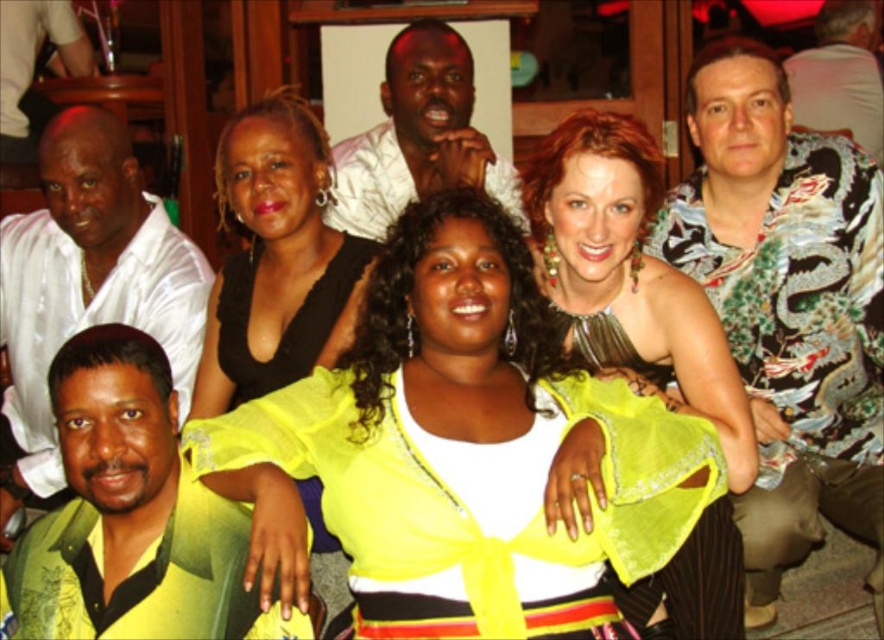
You are organizing a photo shoot and need to arrange two outfits from the image on a mannequin. The shiny yellow blouse at center and the printed silk shirt at upper right must be displayed side by side. Which outfit will require a wider display space?

The shiny yellow blouse at center requires a wider display space because its width is larger than the printed silk shirt at upper right.